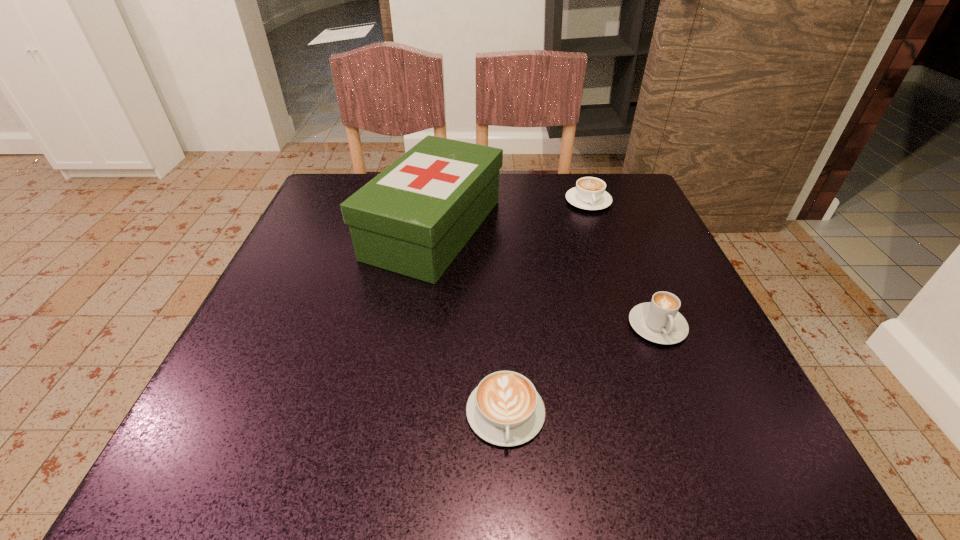
You are a GUI agent. You are given a task and a screenshot of the screen. Output one action in this format:
    pyautogui.click(x=<x>, y=<y>)
    Task: Click on the free space between the nearest cappuccino and the third farthest object
    The width and height of the screenshot is (960, 540).
    Given the screenshot: What is the action you would take?
    pyautogui.click(x=582, y=369)

Image resolution: width=960 pixels, height=540 pixels. I want to click on free area in between the farthest cappuccino and the tallest object, so click(x=511, y=215).

In order to click on object identified as the closest to the tallest object in this screenshot , I will do `click(589, 193)`.

Point out which object is positioned as the nearest to the second nearest cappuccino. Please provide its 2D coordinates. Your answer should be formatted as a tuple, i.e. [(x, y)], where the tuple contains the x and y coordinates of a point satisfying the conditions above.

[(505, 409)]

The width and height of the screenshot is (960, 540). Find the location of `cappuccino that is the closest to the second nearest object`. cappuccino that is the closest to the second nearest object is located at coordinates (505, 409).

Point out which cappuccino is positioned as the nearest to the nearest cappuccino. Please provide its 2D coordinates. Your answer should be formatted as a tuple, i.e. [(x, y)], where the tuple contains the x and y coordinates of a point satisfying the conditions above.

[(659, 321)]